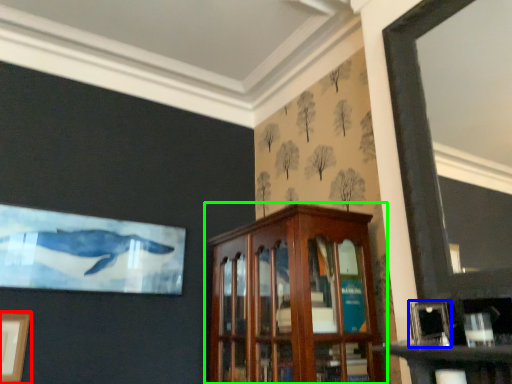
Question: Which object is positioned closest to picture frame (highlighted by a red box)? Select from picture frame (highlighted by a blue box) and cabinetry (highlighted by a green box).

Choices:
 (A) picture frame
 (B) cabinetry

Answer: (B)